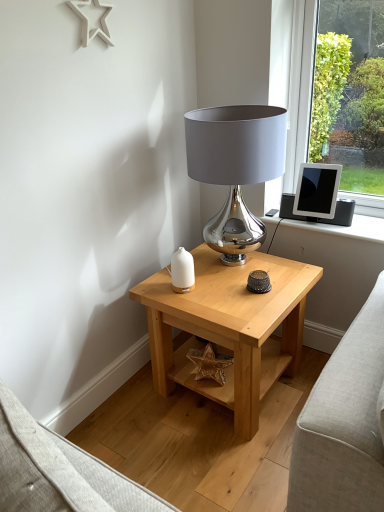
Image resolution: width=384 pixels, height=512 pixels. Identify the location of silver metallic tablet at upper right. (317, 190).

Where is `white glossy vase at center`? white glossy vase at center is located at coordinates (182, 271).

Describe the element at coordinates (182, 271) in the screenshot. I see `white glossy vase at center` at that location.

The image size is (384, 512). What do you see at coordinates (235, 166) in the screenshot?
I see `shiny metallic lamp at upper center` at bounding box center [235, 166].

What do you see at coordinates (230, 327) in the screenshot?
I see `natural wood side table at center` at bounding box center [230, 327].

Find the location of a particular element. Image resolution: width=384 pixels, height=512 pixels. silver metallic tablet at upper right is located at coordinates (317, 190).

Is point (176, 271) closer or farther from the camera than point (284, 308)?

Point (176, 271) is farther from the camera than point (284, 308).

Is natural wood side table at center surrounded by white glossy vase at center?

No.

Considering the positions of objects white glossy vase at center and natural wood side table at center in the image provided, who is more to the right, white glossy vase at center or natural wood side table at center?

From the viewer's perspective, natural wood side table at center appears more on the right side.

Measure the distance from white glossy vase at center to natural wood side table at center.

white glossy vase at center is 11.73 inches from natural wood side table at center.

The image size is (384, 512). What are the coordinates of `computer monitor behind the shiny metallic lamp at upper center` in the screenshot? It's located at (317, 190).

Would you say silver metallic tablet at upper right is part of shiny metallic lamp at upper center's contents?

No, silver metallic tablet at upper right is not inside shiny metallic lamp at upper center.

Considering the positions of points (265, 106) and (310, 198), is point (265, 106) farther from camera compared to point (310, 198)?

That is False.

Between shiny metallic lamp at upper center and silver metallic tablet at upper right, which one appears on the right side from the viewer's perspective?

silver metallic tablet at upper right.

From the picture: From the image's perspective, which is below, white glossy vase at center or shiny metallic lamp at upper center?

white glossy vase at center, from the image's perspective.

Is point (185, 279) positioned behind point (211, 153)?

Yes, point (185, 279) is farther from viewer.

Measure the distance between white glossy vase at center and silver metallic tablet at upper right.

A distance of 5.31 feet exists between white glossy vase at center and silver metallic tablet at upper right.

From the image's perspective, is white glossy vase at center located beneath silver metallic tablet at upper right?

Correct, white glossy vase at center appears lower than silver metallic tablet at upper right in the image.

From the picture: Are white glossy vase at center and silver metallic tablet at upper right making contact?

white glossy vase at center and silver metallic tablet at upper right are not in contact.

Looking at this image, is white glossy vase at center surrounding silver metallic tablet at upper right?

No, white glossy vase at center does not contain silver metallic tablet at upper right.

How distant is silver metallic tablet at upper right from natural wood side table at center?

silver metallic tablet at upper right is 34.72 inches away from natural wood side table at center.

Is silver metallic tablet at upper right facing away from natural wood side table at center?

silver metallic tablet at upper right does not have its back to natural wood side table at center.

Is silver metallic tablet at upper right far from natural wood side table at center?

No, silver metallic tablet at upper right is not far from natural wood side table at center.

Considering the relative sizes of natural wood side table at center and silver metallic tablet at upper right in the image provided, is natural wood side table at center thinner than silver metallic tablet at upper right?

No.

From the image's perspective, which is below, natural wood side table at center or silver metallic tablet at upper right?

natural wood side table at center, from the image's perspective.

Looking at this image, considering the positions of objects natural wood side table at center and silver metallic tablet at upper right in the image provided, who is more to the right, natural wood side table at center or silver metallic tablet at upper right?

Positioned to the right is silver metallic tablet at upper right.

How much distance is there between natural wood side table at center and silver metallic tablet at upper right?

natural wood side table at center and silver metallic tablet at upper right are 88.19 centimeters apart from each other.

At what (x,y) coordinates should I click in order to perform the action: click on table below the shiny metallic lamp at upper center (from a real-world perspective). Please return your answer as a coordinate pair (x, y). The width and height of the screenshot is (384, 512). Looking at the image, I should click on (230, 327).

Is shiny metallic lamp at upper center taller or shorter than natural wood side table at center?

shiny metallic lamp at upper center is taller than natural wood side table at center.

Could you tell me if shiny metallic lamp at upper center is facing natural wood side table at center?

No, shiny metallic lamp at upper center is not facing towards natural wood side table at center.

Looking at this image, from the image's perspective, between shiny metallic lamp at upper center and natural wood side table at center, who is located below?

natural wood side table at center appears lower in the image.

Locate an element on the screen. table below the white glossy vase at center (from the image's perspective) is located at coordinates (230, 327).

Locate an element on the screen. This screenshot has width=384, height=512. computer monitor directly beneath the shiny metallic lamp at upper center (from a real-world perspective) is located at coordinates (317, 190).

When comparing their distances from silver metallic tablet at upper right, does natural wood side table at center or white glossy vase at center seem further?

Based on the image, white glossy vase at center appears to be further to silver metallic tablet at upper right.

Estimate the real-world distances between objects in this image. Which object is further from silver metallic tablet at upper right, shiny metallic lamp at upper center or white glossy vase at center?

white glossy vase at center is further to silver metallic tablet at upper right.

From the image, which object appears to be nearer to white glossy vase at center, natural wood side table at center or silver metallic tablet at upper right?

natural wood side table at center is positioned closer to the anchor white glossy vase at center.

Considering their positions, is white glossy vase at center positioned closer to shiny metallic lamp at upper center than silver metallic tablet at upper right?

white glossy vase at center.

From the picture: Which object lies nearer to the anchor point white glossy vase at center, silver metallic tablet at upper right or shiny metallic lamp at upper center?

shiny metallic lamp at upper center is positioned closer to the anchor white glossy vase at center.

Which object lies nearer to the anchor point shiny metallic lamp at upper center, silver metallic tablet at upper right or natural wood side table at center?

Among the two, natural wood side table at center is located nearer to shiny metallic lamp at upper center.

Estimate the real-world distances between objects in this image. Which object is closer to natural wood side table at center, white glossy vase at center or silver metallic tablet at upper right?

white glossy vase at center lies closer to natural wood side table at center than the other object.

Which object lies further to the anchor point white glossy vase at center, natural wood side table at center or shiny metallic lamp at upper center?

shiny metallic lamp at upper center lies further to white glossy vase at center than the other object.

Identify the location of candle holder that lies between silver metallic tablet at upper right and natural wood side table at center from top to bottom. (182, 271).

At what (x,y) coordinates should I click in order to perform the action: click on lamp between silver metallic tablet at upper right and natural wood side table at center from top to bottom. Please return your answer as a coordinate pair (x, y). Image resolution: width=384 pixels, height=512 pixels. Looking at the image, I should click on (235, 166).

The height and width of the screenshot is (512, 384). I want to click on candle holder that lies between shiny metallic lamp at upper center and natural wood side table at center from top to bottom, so click(x=182, y=271).

Locate an element on the screen. lamp between white glossy vase at center and silver metallic tablet at upper right in the horizontal direction is located at coordinates (235, 166).